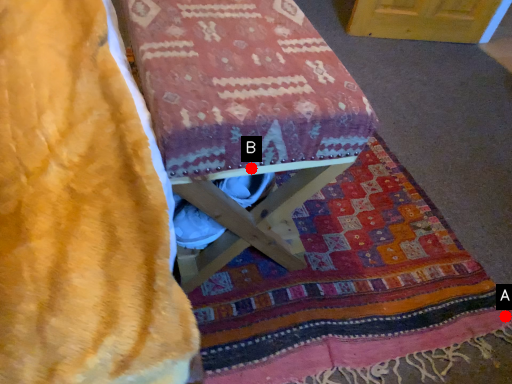
Question: Two points are circled on the image, labeled by A and B beside each circle. Which point is farther from the camera taking this photo?

Choices:
 (A) A is further
 (B) B is further

Answer: (A)